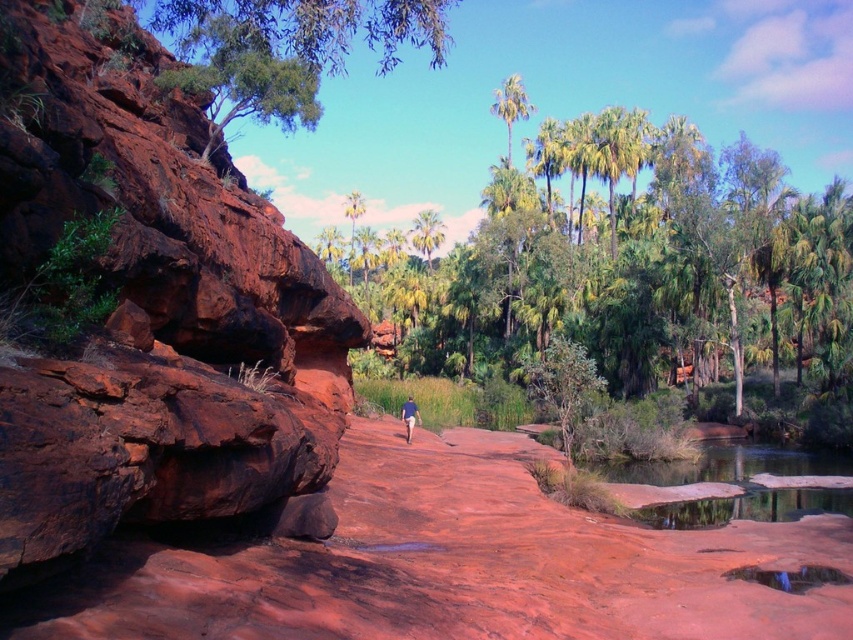
Question: Does rusty rock at left appear on the right side of green leafy tree at upper left?

Choices:
 (A) yes
 (B) no

Answer: (A)

Question: Does reddish-brown rock at center have a greater width compared to green leafy tree at upper left?

Choices:
 (A) yes
 (B) no

Answer: (B)

Question: Which object is positioned farthest from the reddish-brown rock at center?

Choices:
 (A) green leafy tree at center
 (B) green leafy tree at upper left
 (C) rusty rock at left

Answer: (A)

Question: Which of the following is the closest to the observer?

Choices:
 (A) reddish-brown rock at center
 (B) green leafy tree at center

Answer: (A)

Question: In this image, where is green leafy tree at center located relative to green leafy tree at upper left?

Choices:
 (A) below
 (B) above

Answer: (A)

Question: Which of these objects is positioned farthest from the reddish-brown rock at center?

Choices:
 (A) green leafy tree at upper left
 (B) green leafy tree at center
 (C) blue fabric hiker at center

Answer: (B)